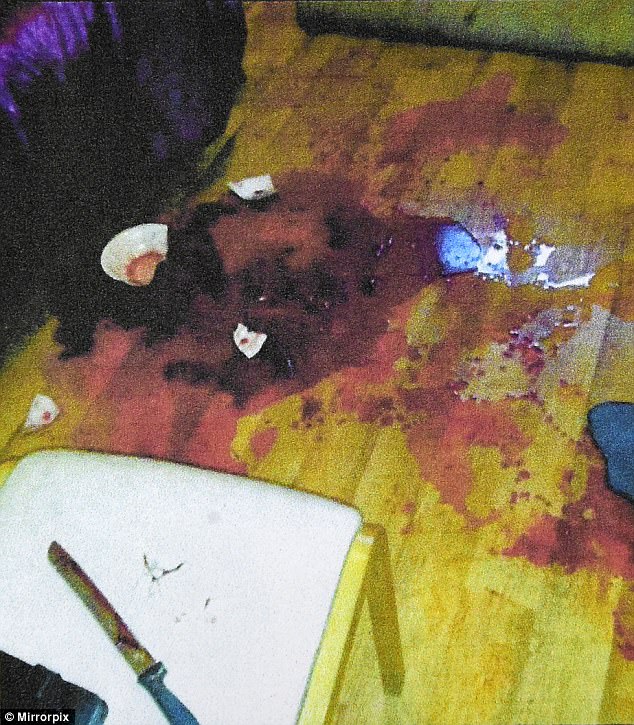
Locate an element on the screen. broken bowl is located at coordinates (141, 256).